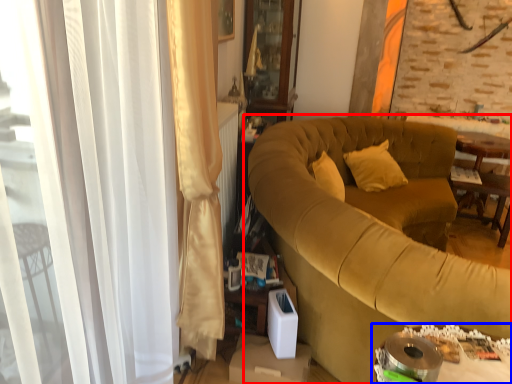
Question: Which object is closer to the camera taking this photo, studio couch (highlighted by a red box) or table (highlighted by a blue box)?

Choices:
 (A) studio couch
 (B) table

Answer: (B)